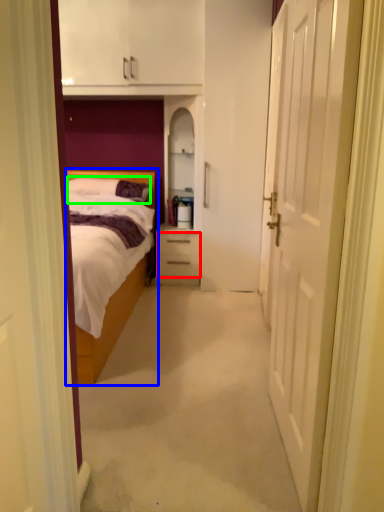
Question: Considering the real-world distances, which object is farthest from drawer (highlighted by a red box)? bed (highlighted by a blue box) or pillow (highlighted by a green box)?

Choices:
 (A) bed
 (B) pillow

Answer: (A)